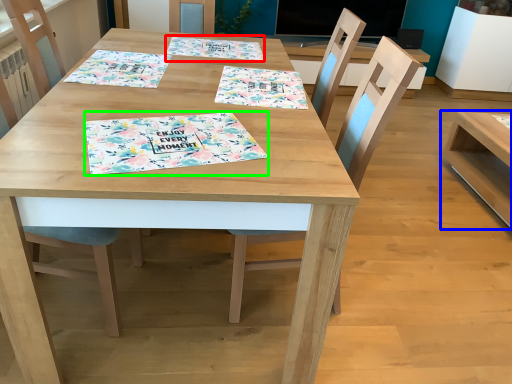
Question: Which is nearer to the tablecloth (highlighted by a red box)? table (highlighted by a blue box) or place mat (highlighted by a green box).

Choices:
 (A) table
 (B) place mat

Answer: (B)